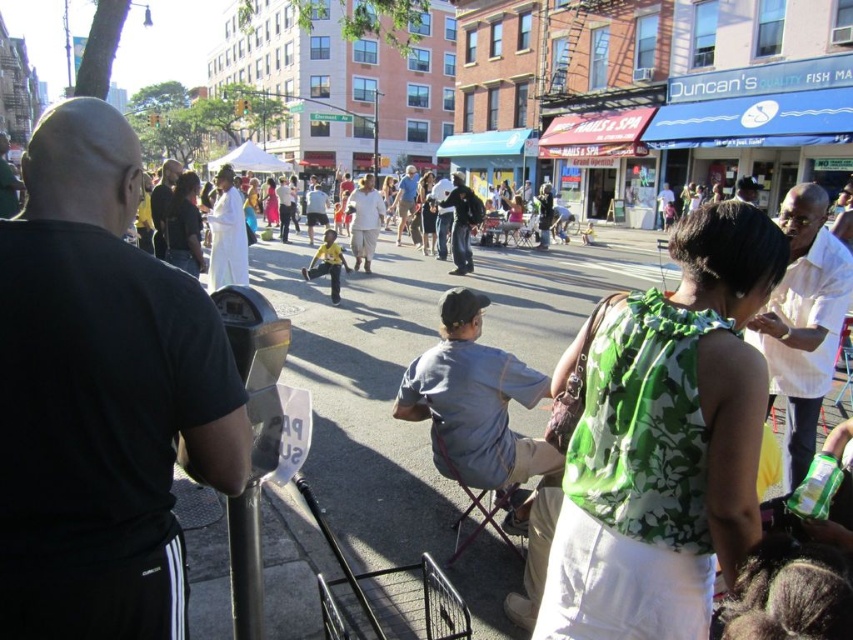
Question: Which point is farther to the camera?

Choices:
 (A) light blue shirt at center
 (B) dark gray shirt at center
 (C) black matte t-shirt at upper left
 (D) metallic gray parking meter at lower left

Answer: (A)

Question: Does black matte t-shirt at upper left appear over green floral blouse at center?

Choices:
 (A) yes
 (B) no

Answer: (A)

Question: Which point is farther to the camera?

Choices:
 (A) black matte t-shirt at upper left
 (B) metallic gray parking meter at lower left

Answer: (B)

Question: Which point appears closest to the camera in this image?

Choices:
 (A) (163, 176)
 (B) (749, 321)
 (C) (256, 337)
 (D) (587, 561)

Answer: (D)

Question: Can you confirm if black matte t-shirt at upper left is positioned below dark gray shirt at center?

Choices:
 (A) yes
 (B) no

Answer: (A)

Question: Does black matte t-shirt at upper left have a smaller size compared to green floral blouse at center?

Choices:
 (A) no
 (B) yes

Answer: (B)